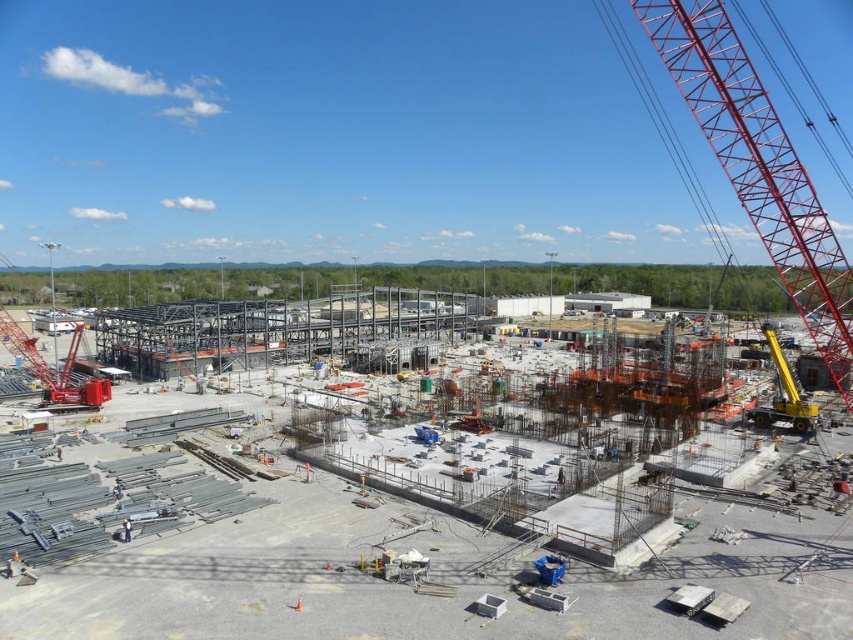
You are an inspector standing at the entrance of the construction site. You need to check the gray metallic structure at center and the metallic red crane at left. According to the layout, which object is located to the right of the other?

The gray metallic structure at center is positioned on the right side of the metallic red crane at left, so the gray metallic structure at center is to the right of the metallic red crane at left.

You are an engineer overseeing a construction site. You need to determine if the gray metallic structure at center can be lifted by the yellow metallic crane at right. The crane has a maximum lifting height of 10 meters. Can the crane lift the structure?

The gray metallic structure at center is shorter than the yellow metallic crane at right, meaning the crane can reach it. Since the crane has a maximum lifting height of 10 meters and the structure is shorter than the crane, it is feasible for the crane to lift the structure.

You are an engineer observing the construction site. You need to determine which crane is positioned higher relative to the other. Which crane is situated at a higher elevation between the metallic red crane at left and the yellow metallic crane at right?

The metallic red crane at left is located above the yellow metallic crane at right, so it is situated at a higher elevation.